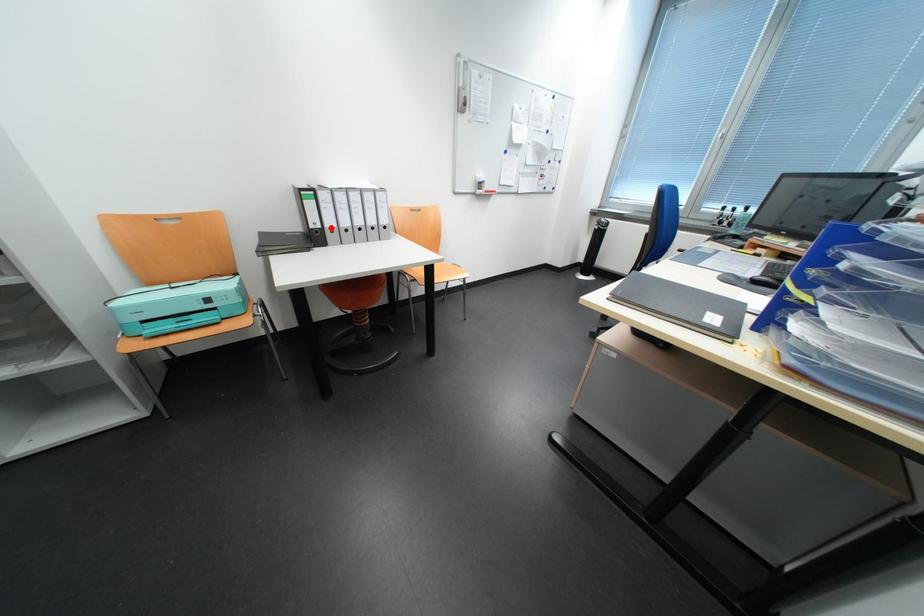
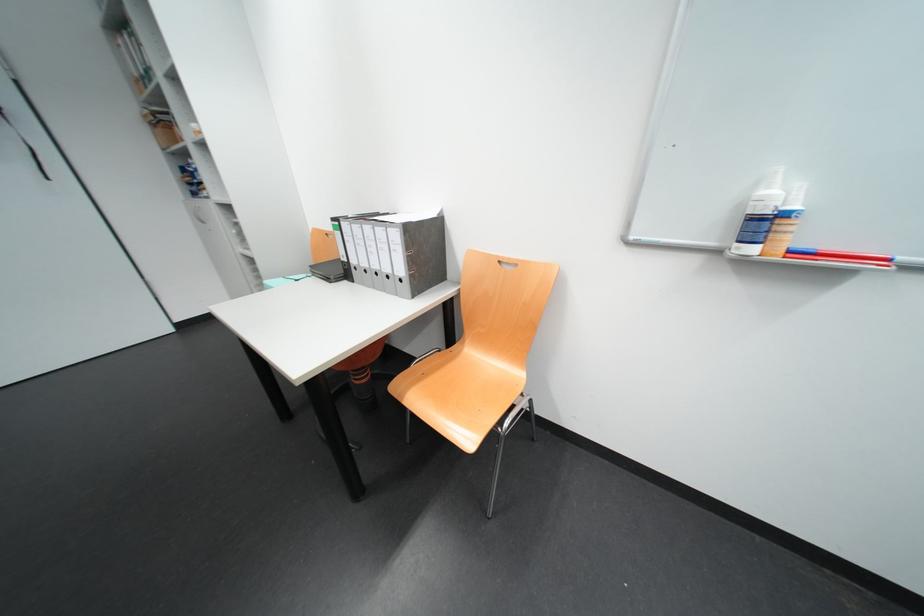
Question: I am providing you with two images of the same scene from different viewpoints. Image1 has a red point marked. In image2, the corresponding 3D location appears at what relative position? Reply with the corresponding letter.

Choices:
 (A) Closer
 (B) Farther

Answer: (B)